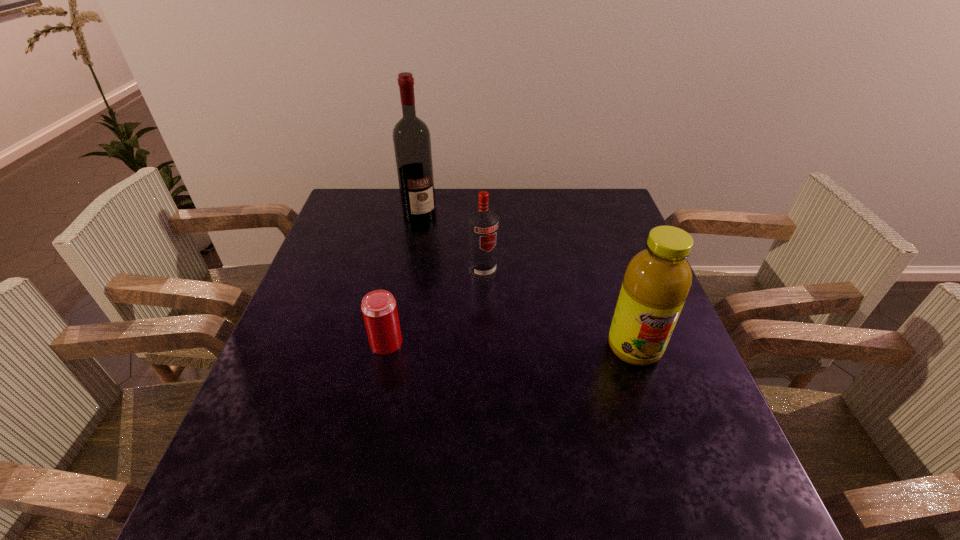
I want to click on free space on the desktop that is between the beer can and the rightmost object and is positioned on the front label of the third nearest object, so click(x=530, y=346).

In order to click on free space on the desktop that is between the shortest object and the fruit juice and is positioned on the front and back of the alcohol in this screenshot , I will do `click(513, 345)`.